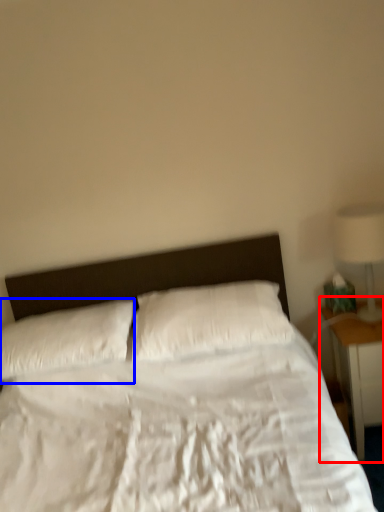
Question: Which point is closer to the camera, nightstand (highlighted by a red box) or pillow (highlighted by a blue box)?

Choices:
 (A) nightstand
 (B) pillow

Answer: (B)